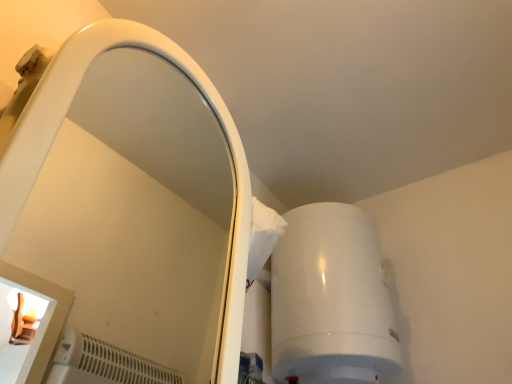
Identify the location of white glossy water heater at upper right. The width and height of the screenshot is (512, 384). (331, 299).

Describe the element at coordinates (331, 299) in the screenshot. Image resolution: width=512 pixels, height=384 pixels. I see `white glossy water heater at upper right` at that location.

What is the approximate width of white glossy mirror at upper left?

The width of white glossy mirror at upper left is 10.14 inches.

What do you see at coordinates (135, 212) in the screenshot? The width and height of the screenshot is (512, 384). I see `white glossy mirror at upper left` at bounding box center [135, 212].

Locate an element on the screen. white glossy mirror at upper left is located at coordinates (135, 212).

Find the location of a particular element. Image resolution: width=512 pixels, height=384 pixels. white glossy water heater at upper right is located at coordinates (331, 299).

Is white glossy water heater at upper right at the right side of white glossy mirror at upper left?

Indeed, white glossy water heater at upper right is positioned on the right side of white glossy mirror at upper left.

Is white glossy water heater at upper right positioned in front of white glossy mirror at upper left?

No.

Does point (279, 353) come farther from viewer compared to point (177, 206)?

No, it is not.

From the image's perspective, is white glossy water heater at upper right positioned above or below white glossy mirror at upper left?

white glossy water heater at upper right is situated lower than white glossy mirror at upper left in the image.

From a real-world perspective, is white glossy water heater at upper right over white glossy mirror at upper left?

Yes, from a real-world perspective, white glossy water heater at upper right is on top of white glossy mirror at upper left.

Considering the relative sizes of white glossy water heater at upper right and white glossy mirror at upper left in the image provided, is white glossy water heater at upper right thinner than white glossy mirror at upper left?

In fact, white glossy water heater at upper right might be wider than white glossy mirror at upper left.

Considering the relative sizes of white glossy water heater at upper right and white glossy mirror at upper left in the image provided, is white glossy water heater at upper right taller than white glossy mirror at upper left?

Incorrect, the height of white glossy water heater at upper right is not larger of that of white glossy mirror at upper left.

Considering the sizes of objects white glossy water heater at upper right and white glossy mirror at upper left in the image provided, who is bigger, white glossy water heater at upper right or white glossy mirror at upper left?

With larger size is white glossy water heater at upper right.

Would you say white glossy mirror at upper left is part of white glossy water heater at upper right's contents?

No, white glossy mirror at upper left is not inside white glossy water heater at upper right.

Is white glossy water heater at upper right beside white glossy mirror at upper left?

No, white glossy water heater at upper right is not touching white glossy mirror at upper left.

Is white glossy water heater at upper right looking in the opposite direction of white glossy mirror at upper left?

That's not correct — white glossy water heater at upper right is not looking away from white glossy mirror at upper left.

What's the angular difference between white glossy water heater at upper right and white glossy mirror at upper left's facing directions?

They differ by 1.23 degrees in their facing directions.

Measure the distance from white glossy water heater at upper right to white glossy mirror at upper left.

A distance of 25.32 inches exists between white glossy water heater at upper right and white glossy mirror at upper left.

In the image, there is a white glossy water heater at upper right. What are the coordinates of `mirror above it (from the image's perspective)` in the screenshot? It's located at (135, 212).

Considering the positions of objects white glossy mirror at upper left and white glossy water heater at upper right in the image provided, who is more to the left, white glossy mirror at upper left or white glossy water heater at upper right?

white glossy mirror at upper left is more to the left.

Which is in front, white glossy mirror at upper left or white glossy water heater at upper right?

white glossy mirror at upper left is more forward.

Does point (160, 329) come closer to viewer compared to point (360, 250)?

That is False.

From the image's perspective, is white glossy mirror at upper left positioned above or below white glossy water heater at upper right?

Based on their image positions, white glossy mirror at upper left is located above white glossy water heater at upper right.

From a real-world perspective, is white glossy mirror at upper left physically above white glossy water heater at upper right?

Incorrect, from a real-world perspective, white glossy mirror at upper left is lower than white glossy water heater at upper right.

Which object is wider, white glossy mirror at upper left or white glossy water heater at upper right?

With larger width is white glossy water heater at upper right.

Who is taller, white glossy mirror at upper left or white glossy water heater at upper right?

white glossy mirror at upper left.

Who is smaller, white glossy mirror at upper left or white glossy water heater at upper right?

With smaller size is white glossy mirror at upper left.

Is white glossy mirror at upper left spatially inside white glossy water heater at upper right, or outside of it?

white glossy mirror at upper left exists outside the volume of white glossy water heater at upper right.

Is white glossy mirror at upper left not close to white glossy water heater at upper right?

No, there isn't a large distance between white glossy mirror at upper left and white glossy water heater at upper right.

Could you tell me if white glossy mirror at upper left is facing white glossy water heater at upper right?

No, white glossy mirror at upper left is not facing towards white glossy water heater at upper right.

How distant is white glossy mirror at upper left from white glossy water heater at upper right?

white glossy mirror at upper left is 64.30 centimeters away from white glossy water heater at upper right.

Where is `appliance above the white glossy mirror at upper left (from a real-world perspective)`? Image resolution: width=512 pixels, height=384 pixels. appliance above the white glossy mirror at upper left (from a real-world perspective) is located at coordinates (331, 299).

Find the location of a particular element. The height and width of the screenshot is (384, 512). mirror below the white glossy water heater at upper right (from a real-world perspective) is located at coordinates (135, 212).

At what (x,y) coordinates should I click in order to perform the action: click on appliance above the white glossy mirror at upper left (from a real-world perspective). Please return your answer as a coordinate pair (x, y). Looking at the image, I should click on (331, 299).